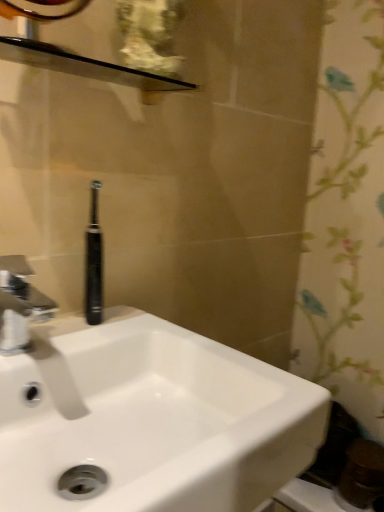
Question: Is black glossy balustrade at upper center located within white glossy sink at center?

Choices:
 (A) no
 (B) yes

Answer: (A)

Question: Is the position of white glossy sink at center less distant than that of black glossy balustrade at upper center?

Choices:
 (A) yes
 (B) no

Answer: (A)

Question: Considering the relative sizes of white glossy sink at center and black glossy balustrade at upper center in the image provided, is white glossy sink at center taller than black glossy balustrade at upper center?

Choices:
 (A) yes
 (B) no

Answer: (A)

Question: Does white glossy sink at center have a lesser height compared to black glossy balustrade at upper center?

Choices:
 (A) yes
 (B) no

Answer: (B)

Question: Is the depth of white glossy sink at center greater than that of black glossy balustrade at upper center?

Choices:
 (A) yes
 (B) no

Answer: (B)

Question: From the image's perspective, is white glossy sink at center over black glossy balustrade at upper center?

Choices:
 (A) yes
 (B) no

Answer: (B)

Question: From a real-world perspective, is black glossy balustrade at upper center on black rubber toothbrush at center?

Choices:
 (A) no
 (B) yes

Answer: (B)

Question: Is black glossy balustrade at upper center bigger than black rubber toothbrush at center?

Choices:
 (A) yes
 (B) no

Answer: (A)

Question: Could you tell me if black glossy balustrade at upper center is facing black rubber toothbrush at center?

Choices:
 (A) yes
 (B) no

Answer: (B)

Question: Is black glossy balustrade at upper center looking in the opposite direction of black rubber toothbrush at center?

Choices:
 (A) no
 (B) yes

Answer: (A)

Question: Does black glossy balustrade at upper center come behind black rubber toothbrush at center?

Choices:
 (A) no
 (B) yes

Answer: (A)

Question: Is the position of black glossy balustrade at upper center less distant than that of black rubber toothbrush at center?

Choices:
 (A) no
 (B) yes

Answer: (B)

Question: Is black rubber toothbrush at center bigger than silver metallic faucet at left?

Choices:
 (A) yes
 (B) no

Answer: (B)